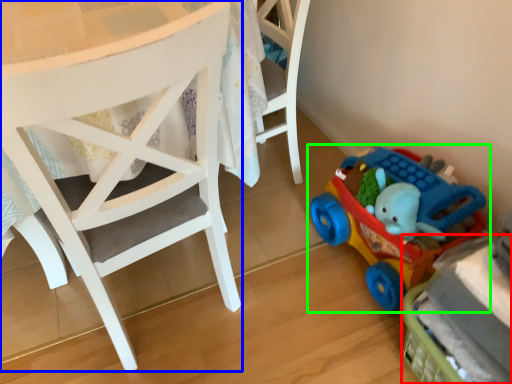
Question: Considering the real-world distances, which object is closest to toy (highlighted by a red box)? chair (highlighted by a blue box) or toy (highlighted by a green box).

Choices:
 (A) chair
 (B) toy

Answer: (B)